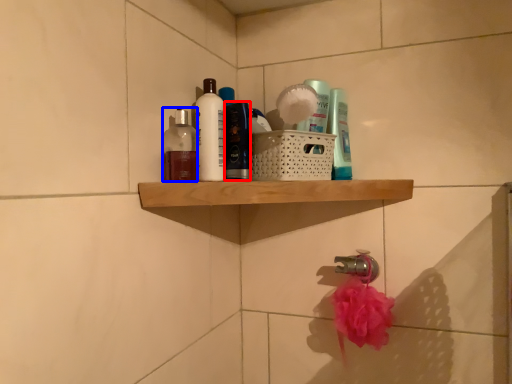
Question: Which point is further to the camera, toiletry (highlighted by a red box) or toiletry (highlighted by a blue box)?

Choices:
 (A) toiletry
 (B) toiletry

Answer: (A)